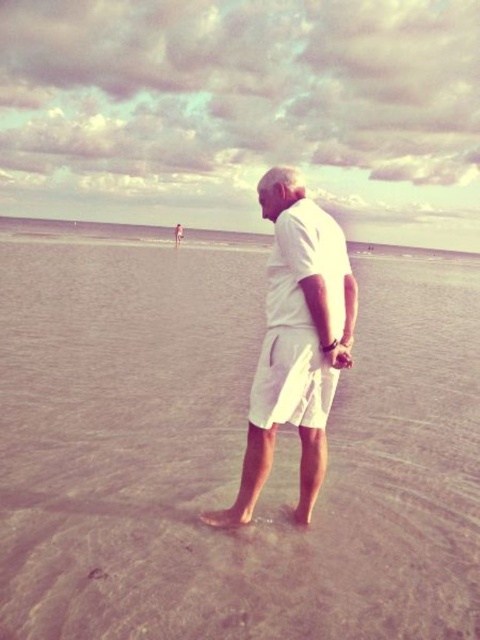
Looking at this image, what is the exact coordinate of the sandy beach at center?

The sandy beach at center is located at point [228,452].

You are standing at the position marked by the point at coordinates (228, 452) on the image. Looking around, what do you see directly in front of you?

The point at coordinates (228, 452) indicates sandy beach at center, so directly in front of you would be the sandy beach at center.

You are a photographer trying to capture the entire sandy beach at center and the white cotton shorts at center in a single frame. Based on their sizes, which object should you focus on first to ensure both are in the shot?

The sandy beach at center has a larger size compared to white cotton shorts at center, so you should focus on the sandy beach at center first to ensure both are in the shot.